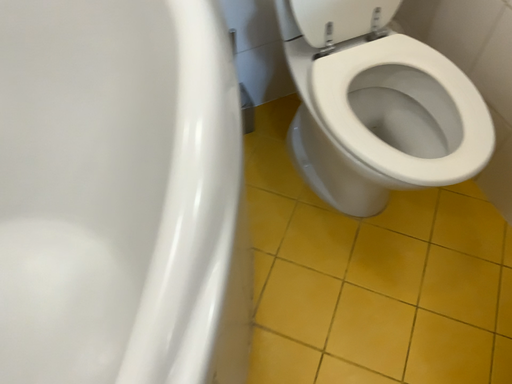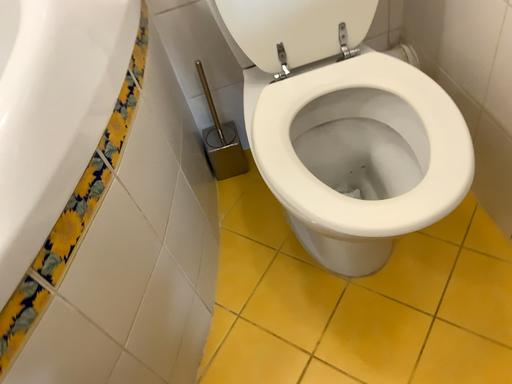
Question: How did the camera likely rotate when shooting the video?

Choices:
 (A) rotated right
 (B) rotated left

Answer: (B)